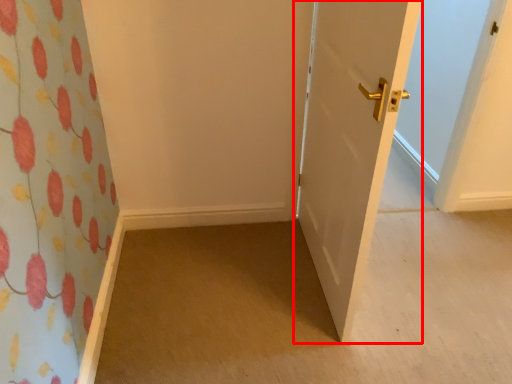
Question: In this image, where is door (annotated by the red box) located relative to plain?

Choices:
 (A) right
 (B) left

Answer: (B)